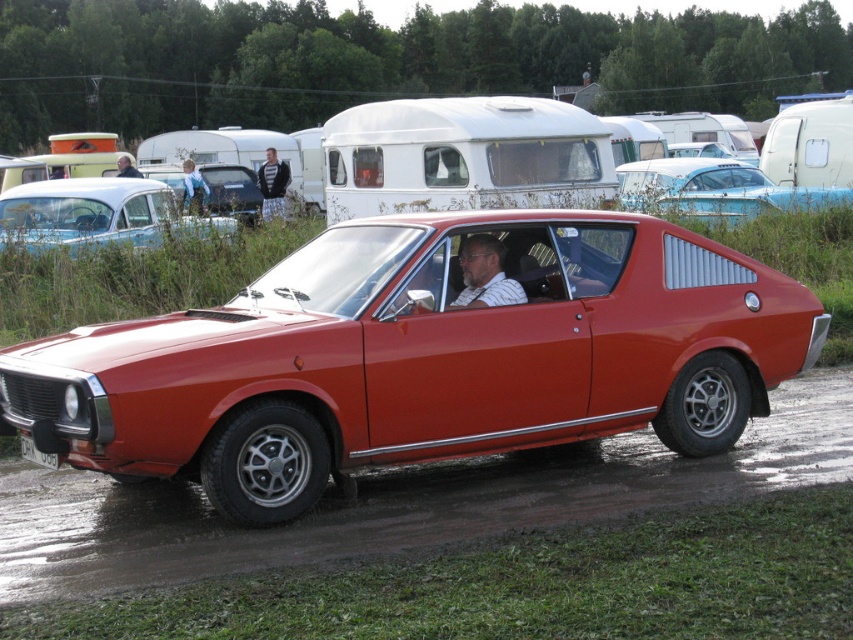
Is dirt track at lower center below matte black car at upper center?

Correct, dirt track at lower center is located below matte black car at upper center.

Between point (44, 477) and point (229, 198), which one is positioned behind?

Point (229, 198)

Which is in front, point (380, 522) or point (228, 189)?

Point (380, 522) is more forward.

Image resolution: width=853 pixels, height=640 pixels. Find the location of `dirt track at lower center`. dirt track at lower center is located at coordinates (397, 502).

Is point (103, 362) farther from camera compared to point (274, 189)?

No, (103, 362) is closer to viewer.

How far apart are shiny red car at center and plaid fabric pants at center?

They are 55.41 feet apart.

The width and height of the screenshot is (853, 640). What are the coordinates of `shiny red car at center` in the screenshot? It's located at (421, 356).

Identify the location of shiny red car at center. This screenshot has height=640, width=853. point(421,356).

Can you confirm if matte blue car at center is taller than blue denim jeans at center?

Indeed, matte blue car at center has a greater height compared to blue denim jeans at center.

Does point (55, 237) lie in front of point (190, 179)?

Yes, it is in front of point (190, 179).

Identify the location of matte blue car at center. (x=97, y=214).